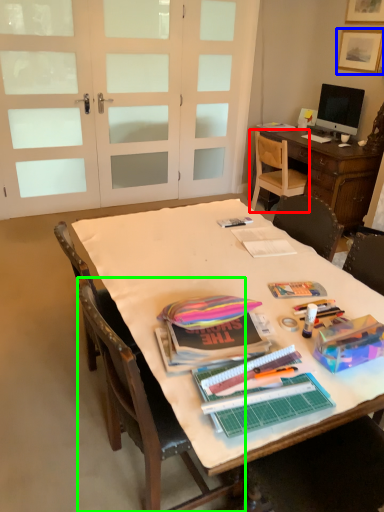
Question: Which is nearer to the chair (highlighted by a red box)? picture frame (highlighted by a blue box) or chair (highlighted by a green box).

Choices:
 (A) picture frame
 (B) chair

Answer: (A)